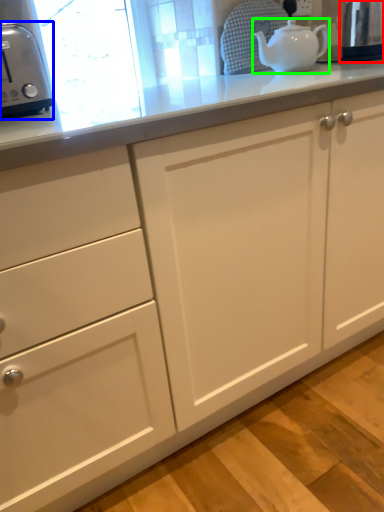
Question: Which object is the farthest from appliance (highlighted by a red box)? Choose among these: toaster (highlighted by a blue box) or teapot (highlighted by a green box).

Choices:
 (A) toaster
 (B) teapot

Answer: (A)